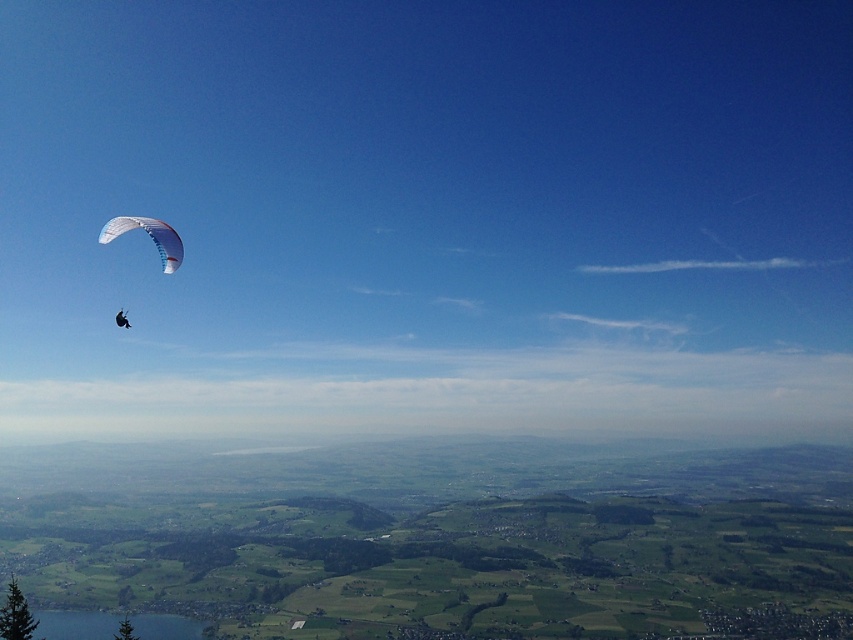
Which of these two, white mesh parachute at left or white fabric parachute at upper left, stands shorter?

white fabric parachute at upper left

Between point (109, 234) and point (120, 321), which one is positioned in front?

Point (120, 321) is more forward.

Is point (97, 241) farther from camera compared to point (119, 314)?

That is True.

Identify the location of white mesh parachute at left. This screenshot has width=853, height=640. (149, 236).